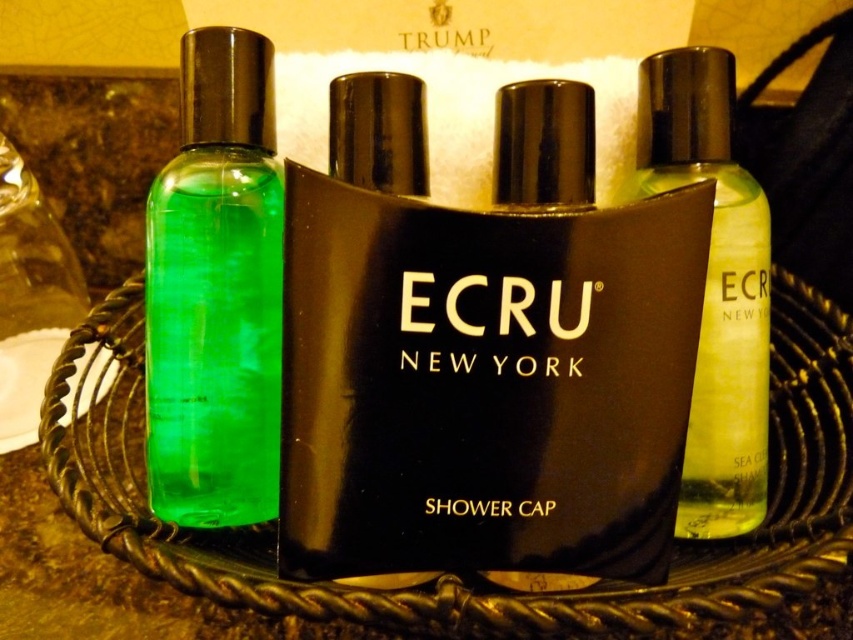
What do you see at coordinates (216, 291) in the screenshot?
I see `green translucent bottle at left` at bounding box center [216, 291].

Does point (223, 138) lie behind point (762, 284)?

No, it is not.

Locate an element on the screen. The width and height of the screenshot is (853, 640). green translucent bottle at left is located at coordinates (216, 291).

Can you confirm if black glossy shower cap at center is shorter than green translucent bottle at left?

Indeed, black glossy shower cap at center has a lesser height compared to green translucent bottle at left.

Consider the image. Measure the distance between point (297, 429) and camera.

They are 47.21 centimeters apart.

Identify the location of black glossy shower cap at center. The width and height of the screenshot is (853, 640). (482, 349).

Between green translucent bottle at left and black matte shower cap at center, which one has less height?

black matte shower cap at center

Can you confirm if green translucent bottle at left is shorter than black matte shower cap at center?

In fact, green translucent bottle at left may be taller than black matte shower cap at center.

Describe the element at coordinates (216, 291) in the screenshot. This screenshot has width=853, height=640. I see `green translucent bottle at left` at that location.

Locate an element on the screen. The width and height of the screenshot is (853, 640). green translucent bottle at left is located at coordinates (216, 291).